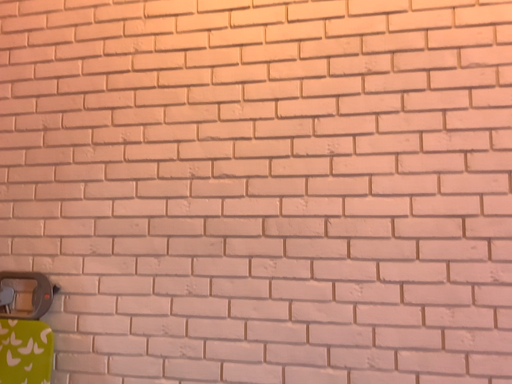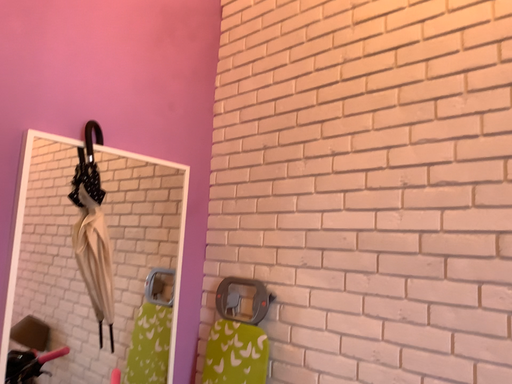
Question: Which way did the camera rotate in the video?

Choices:
 (A) rotated left
 (B) rotated right

Answer: (A)